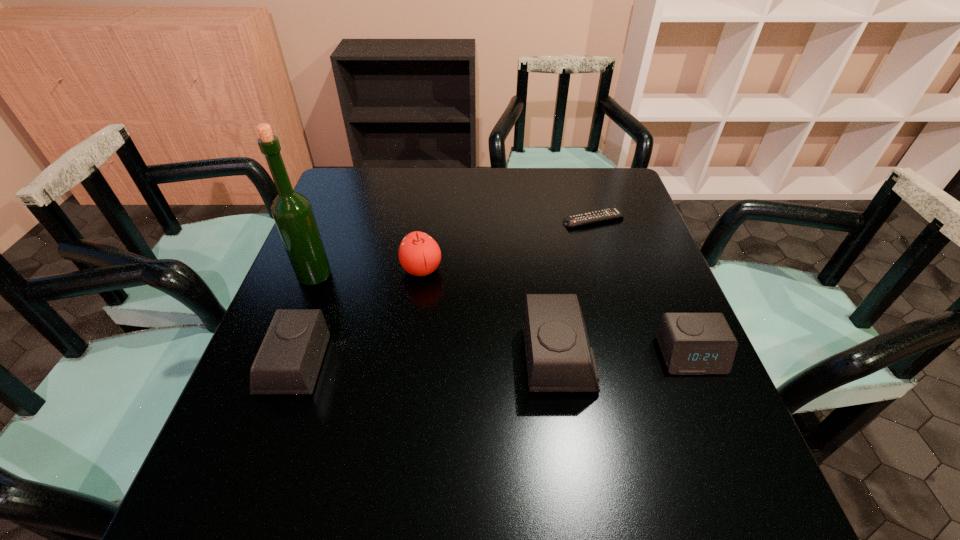
This screenshot has width=960, height=540. I want to click on free region located on the left of the remote control, so click(475, 220).

Locate an element on the screen. This screenshot has height=540, width=960. free space located 0.310m on the front of the third object from left to right is located at coordinates (403, 398).

Identify the location of vacant space located on the right of the liquor. The image size is (960, 540). (368, 276).

Where is `alarm clock located in the left edge section of the desktop`? This screenshot has height=540, width=960. alarm clock located in the left edge section of the desktop is located at coordinates (288, 362).

The image size is (960, 540). Identify the location of liquor that is at the left edge. (292, 212).

Locate an element on the screen. alarm clock that is positioned at the right edge is located at coordinates (691, 343).

At what (x,y) coordinates should I click in order to perform the action: click on remote control that is at the right edge. Please return your answer as a coordinate pair (x, y). The width and height of the screenshot is (960, 540). Looking at the image, I should click on (599, 215).

The width and height of the screenshot is (960, 540). In the image, there is a desktop. Identify the location of vacant region at the far edge. point(457,176).

The image size is (960, 540). I want to click on free space at the near edge of the desktop, so click(403, 425).

The height and width of the screenshot is (540, 960). I want to click on free space at the right edge of the desktop, so click(612, 221).